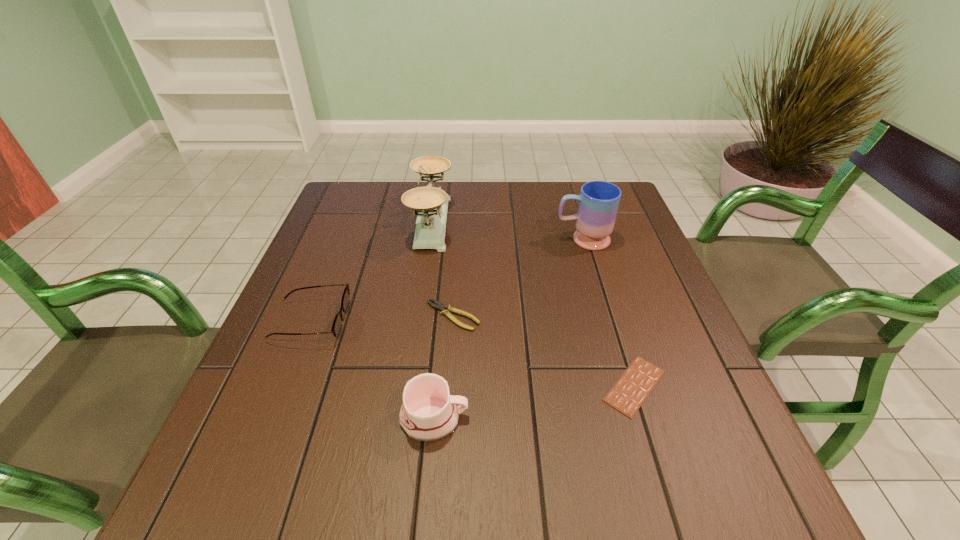
This screenshot has height=540, width=960. What are the coordinates of `chocolate bar that is at the right edge` in the screenshot? It's located at (627, 395).

Image resolution: width=960 pixels, height=540 pixels. I want to click on vacant region at the far edge of the desktop, so click(x=563, y=194).

Image resolution: width=960 pixels, height=540 pixels. I want to click on vacant space at the near edge of the desktop, so click(562, 516).

Find the location of `vacant area at the left edge of the desktop`. vacant area at the left edge of the desktop is located at coordinates (324, 363).

In the image, there is a desktop. Identify the location of free space at the right edge. (623, 319).

At what (x,y) coordinates should I click in order to perform the action: click on vacant space at the far left corner of the desktop. Please return your answer as a coordinate pair (x, y). Image resolution: width=960 pixels, height=540 pixels. Looking at the image, I should click on (353, 191).

The width and height of the screenshot is (960, 540). I want to click on free point at the near right corner, so click(734, 495).

Where is `vacant space that is in between the pliers and the third shortest object`? Image resolution: width=960 pixels, height=540 pixels. vacant space that is in between the pliers and the third shortest object is located at coordinates (382, 319).

Find the location of a particular element. This screenshot has width=960, height=540. vacant region between the pliers and the chocolate bar is located at coordinates (543, 351).

You are a GUI agent. You are given a task and a screenshot of the screen. Output one action in this format:
    pyautogui.click(x=<x>, y=<y>)
    Task: Click on the vacant area that lies between the shortest object and the nearer mug
    This screenshot has height=540, width=960.
    Given the screenshot: What is the action you would take?
    pyautogui.click(x=535, y=402)